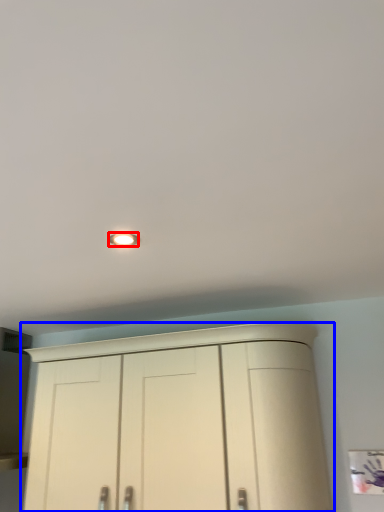
Question: Which object is further to the camera taking this photo, lighting (highlighted by a red box) or cupboard (highlighted by a blue box)?

Choices:
 (A) lighting
 (B) cupboard

Answer: (B)